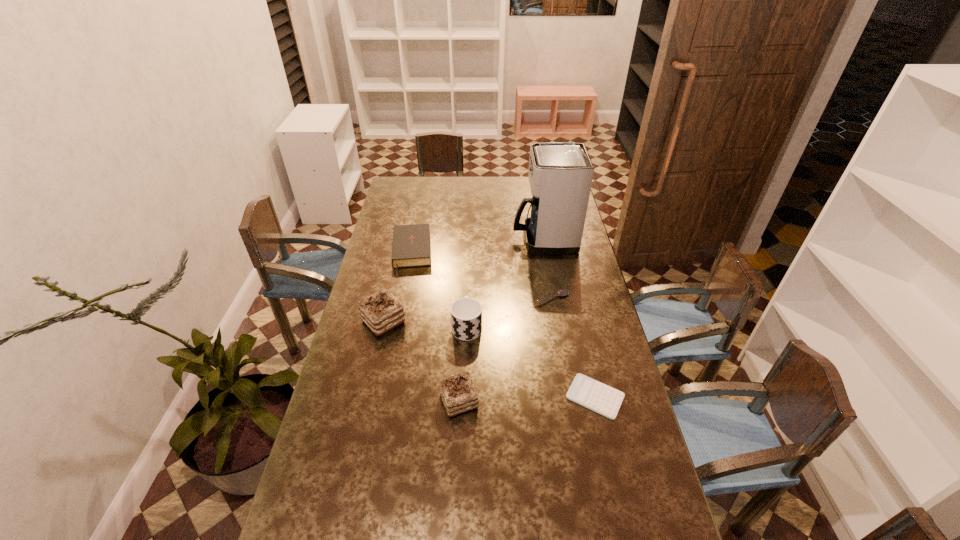
In the current image, all chocolate cakes are evenly spaced. To maintain this equal spacing, where should an additional chocolate cake be placed on the right? Please point out a free spot. Please provide its 2D coordinates. Your answer should be formatted as a tuple, i.e. [(x, y)], where the tuple contains the x and y coordinates of a point satisfying the conditions above.

[(569, 518)]